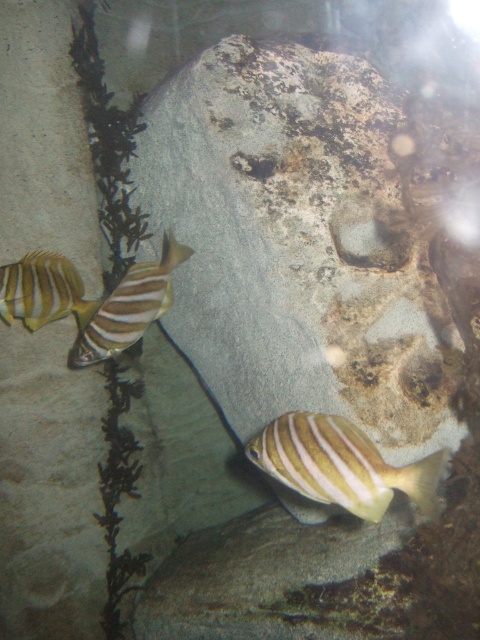
Based on the photo, which is above, yellow striped fish at lower center or shiny yellow fish at left?

shiny yellow fish at left is above.

Looking at this image, between yellow striped fish at lower center and shiny yellow fish at left, which one is positioned lower?

yellow striped fish at lower center

This screenshot has width=480, height=640. What do you see at coordinates (342, 465) in the screenshot? I see `yellow striped fish at lower center` at bounding box center [342, 465].

Locate an element on the screen. The width and height of the screenshot is (480, 640). yellow striped fish at lower center is located at coordinates (342, 465).

Between yellow striped fish at lower center and yellow striped fish at left, which one is positioned lower?

Positioned lower is yellow striped fish at lower center.

Can you confirm if yellow striped fish at lower center is bigger than yellow striped fish at left?

Incorrect, yellow striped fish at lower center is not larger than yellow striped fish at left.

I want to click on yellow striped fish at lower center, so click(x=342, y=465).

Where is `yellow striped fish at lower center`? This screenshot has width=480, height=640. yellow striped fish at lower center is located at coordinates (342, 465).

Between yellow striped fish at left and shiny yellow fish at left, which one appears on the left side from the viewer's perspective?

From the viewer's perspective, shiny yellow fish at left appears more on the left side.

Does yellow striped fish at left have a smaller size compared to shiny yellow fish at left?

No.

Which is behind, point (127, 321) or point (84, 320)?

Positioned behind is point (84, 320).

Identify the location of yellow striped fish at left. (130, 307).